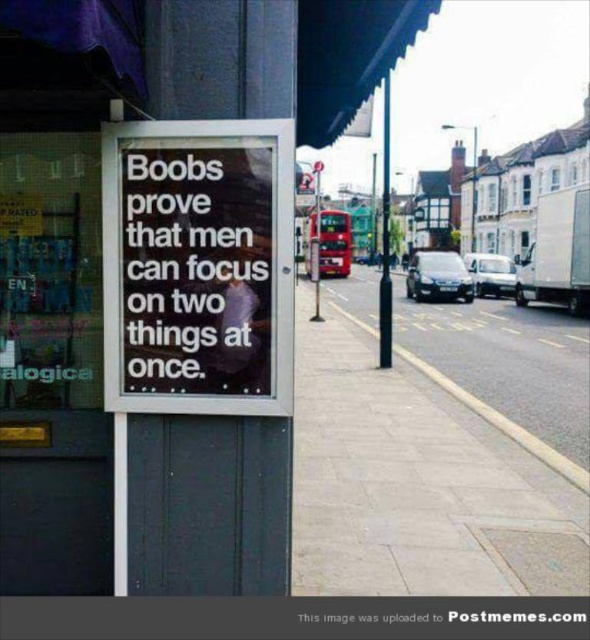
Consider the image. You are standing on the sidewalk next to the alogica store and see two points marked on the ground. The first point is at coordinates point (178, 525) and the second point is at point (124, 216). Which point is closer to you?

Point (178, 525) is closer to you because it is further to the viewer than point (124, 216).

You are a delivery person with a box that is 2 meters long. You need to place the box between the black glass sign at center and the gray concrete sidewalk at lower center. Is there enough space to fit the box horizontally between them?

The black glass sign at center and gray concrete sidewalk at lower center are 1.96 meters apart from each other. Since the box is 2 meters long, it will not fit horizontally between them as the distance is slightly shorter than the box.

From the picture: You are a delivery person trying to read the signboard message. Which object, the black glass sign at center or the black paper at center, is easier to read from a distance?

The black glass sign at center is bigger than the black paper at center, so it is easier to read from a distance.